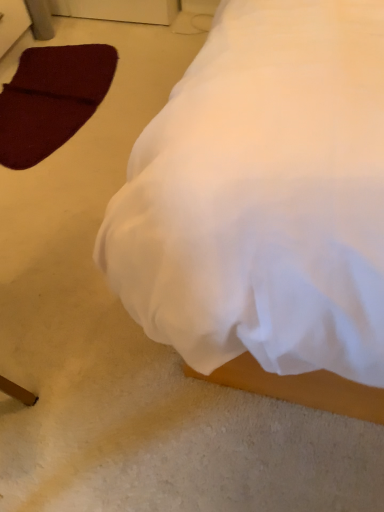
Question: Considering the relative positions of white fabric bed at lower right and maroon felt pad at lower left in the image provided, is white fabric bed at lower right to the left of maroon felt pad at lower left from the viewer's perspective?

Choices:
 (A) no
 (B) yes

Answer: (A)

Question: Is white fabric bed at lower right taller than maroon felt pad at lower left?

Choices:
 (A) no
 (B) yes

Answer: (B)

Question: Does white fabric bed at lower right have a lesser width compared to maroon felt pad at lower left?

Choices:
 (A) yes
 (B) no

Answer: (B)

Question: Can you confirm if white fabric bed at lower right is bigger than maroon felt pad at lower left?

Choices:
 (A) no
 (B) yes

Answer: (B)

Question: Could you tell me if white fabric bed at lower right is turned towards maroon felt pad at lower left?

Choices:
 (A) yes
 (B) no

Answer: (B)

Question: Is white fabric bed at lower right positioned before maroon felt pad at lower left?

Choices:
 (A) no
 (B) yes

Answer: (B)

Question: Is maroon felt pad at lower left shorter than white fabric bed at lower right?

Choices:
 (A) yes
 (B) no

Answer: (A)

Question: Is white fabric bed at lower right surrounded by maroon felt pad at lower left?

Choices:
 (A) yes
 (B) no

Answer: (B)

Question: Is maroon felt pad at lower left closer to camera compared to white fabric bed at lower right?

Choices:
 (A) no
 (B) yes

Answer: (A)

Question: From a real-world perspective, is maroon felt pad at lower left physically below white fabric bed at lower right?

Choices:
 (A) no
 (B) yes

Answer: (B)

Question: Is maroon felt pad at lower left positioned with its back to white fabric bed at lower right?

Choices:
 (A) no
 (B) yes

Answer: (A)

Question: Does maroon felt pad at lower left have a lesser width compared to white fabric bed at lower right?

Choices:
 (A) no
 (B) yes

Answer: (B)

Question: From the image's perspective, is maroon felt pad at lower left above or below white fabric bed at lower right?

Choices:
 (A) above
 (B) below

Answer: (A)